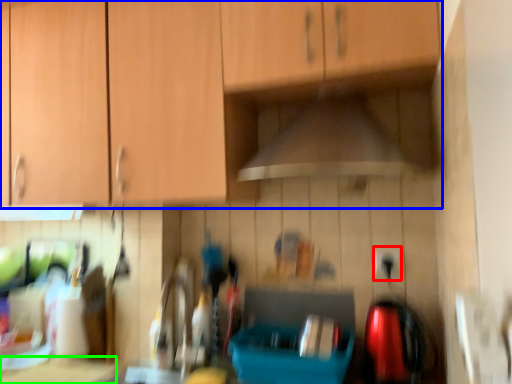
Question: Estimate the real-world distances between objects in this image. Which object is farther from electric outlet (highlighted by a red box), cabinetry (highlighted by a blue box) or counter top (highlighted by a green box)?

Choices:
 (A) cabinetry
 (B) counter top

Answer: (B)